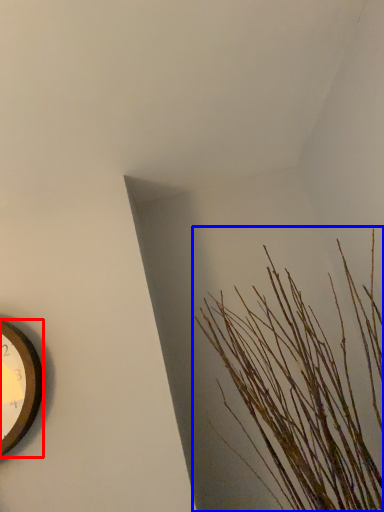
Question: Which object is closer to the camera taking this photo, wall clock (highlighted by a red box) or houseplant (highlighted by a blue box)?

Choices:
 (A) wall clock
 (B) houseplant

Answer: (B)